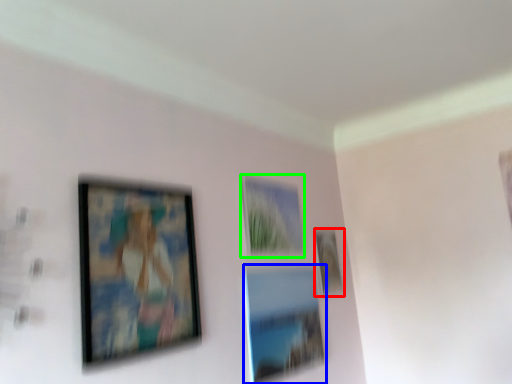
Question: Considering the real-world distances, which object is farthest from picture frame (highlighted by a red box)? picture frame (highlighted by a blue box) or picture frame (highlighted by a green box)?

Choices:
 (A) picture frame
 (B) picture frame

Answer: (A)